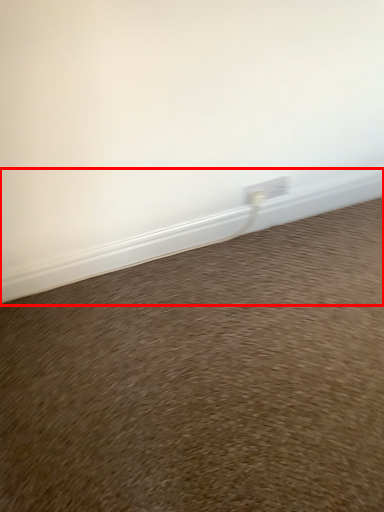
Question: From the image's perspective, where is window sill (annotated by the red box) located in relation to sand in the image?

Choices:
 (A) below
 (B) above

Answer: (B)